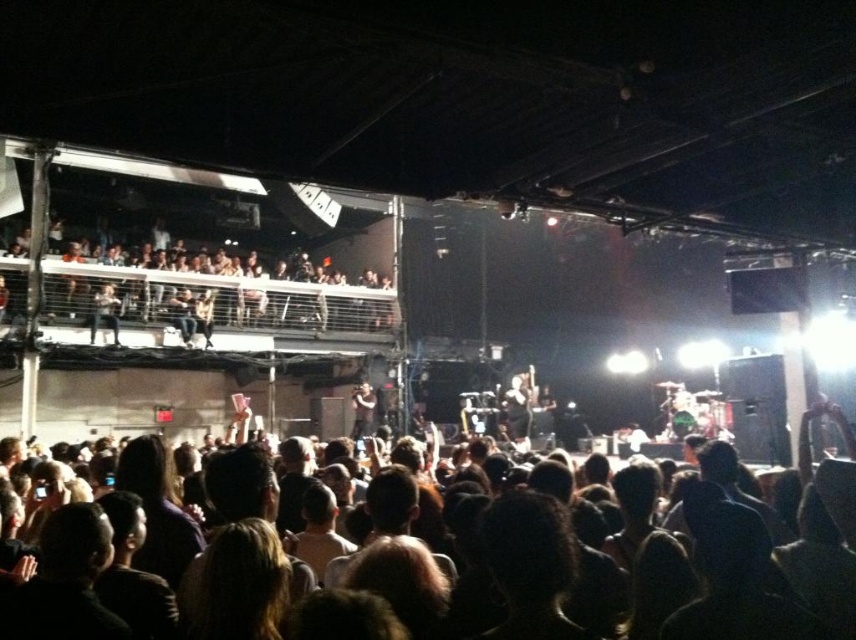
Can you confirm if dark hair at center is positioned above matte black jacket at upper left?

Actually, dark hair at center is below matte black jacket at upper left.

Which is behind, point (340, 634) or point (91, 323)?

The point (91, 323) is more distant.

Does point (705, 595) come in front of point (107, 292)?

That is True.

I want to click on dark hair at center, so click(x=312, y=593).